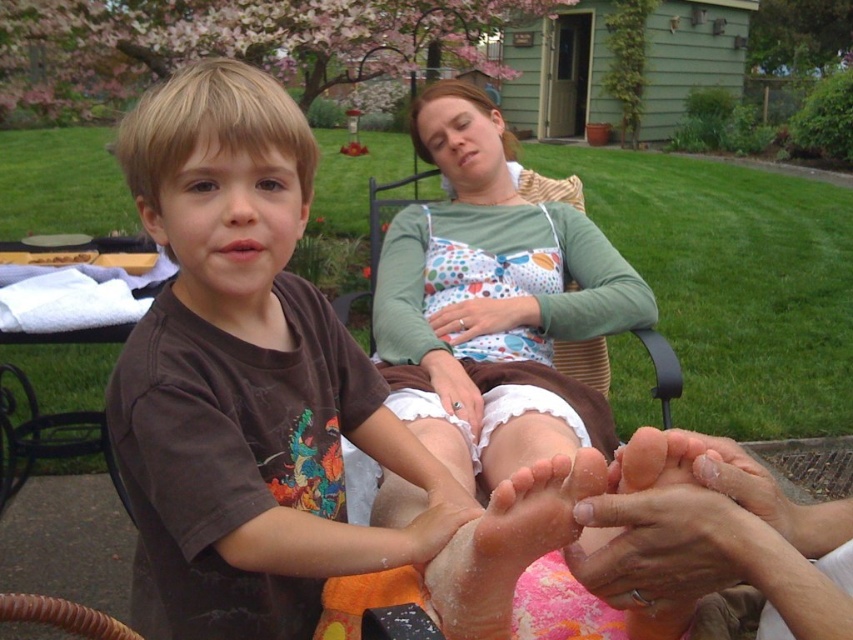
Who is more distant from viewer, (538, 420) or (434, 378)?

Point (434, 378)

Who is more forward, (405, 230) or (440, 348)?

Point (440, 348) is in front.

You are a GUI agent. You are given a task and a screenshot of the screen. Output one action in this format:
    pyautogui.click(x=<x>, y=<y>)
    Task: Click on the polka dot fabric dress at center
    The height and width of the screenshot is (640, 853).
    Given the screenshot: What is the action you would take?
    pyautogui.click(x=495, y=268)

The image size is (853, 640). What are the coordinates of `polka dot fabric dress at center` in the screenshot? It's located at (495, 268).

Which is below, polka dot fabric dress at center or smooth skin feet at lower right?

smooth skin feet at lower right

Identify the location of polka dot fabric dress at center. (495, 268).

Where is `polka dot fabric dress at center`? polka dot fabric dress at center is located at coordinates (495, 268).

In the scene shown: Which of these two, sandy skin feet at lower center or matte white hand at center, stands shorter?

matte white hand at center

Between point (490, 561) and point (454, 384), which one is positioned behind?

The point (454, 384) is behind.

The height and width of the screenshot is (640, 853). Identify the location of sandy skin feet at lower center. (508, 544).